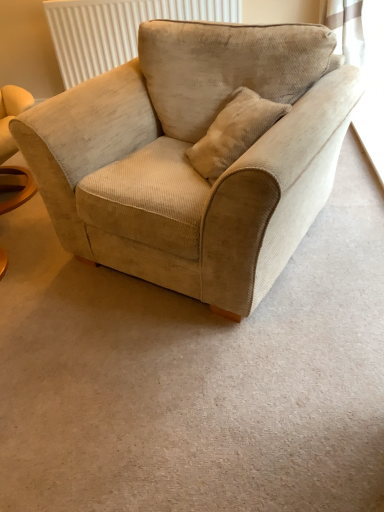
Question: Is point pyautogui.click(x=69, y=116) positioned closer to the camera than point pyautogui.click(x=72, y=62)?

Choices:
 (A) farther
 (B) closer

Answer: (B)

Question: Relative to white textured radiator at upper center, is beige corduroy armchair at center in front or behind?

Choices:
 (A) behind
 (B) front

Answer: (B)

Question: Is beige corduroy armchair at center taller or shorter than white textured radiator at upper center?

Choices:
 (A) short
 (B) tall

Answer: (B)

Question: From the image's perspective, relative to beige corduroy armchair at center, is white textured radiator at upper center above or below?

Choices:
 (A) below
 (B) above

Answer: (B)

Question: Is point (74, 84) closer or farther from the camera than point (241, 185)?

Choices:
 (A) closer
 (B) farther

Answer: (B)

Question: From a real-world perspective, is white textured radiator at upper center above or below beige corduroy armchair at center?

Choices:
 (A) below
 (B) above

Answer: (B)

Question: Is white textured radiator at upper center spatially inside beige corduroy armchair at center, or outside of it?

Choices:
 (A) inside
 (B) outside

Answer: (B)